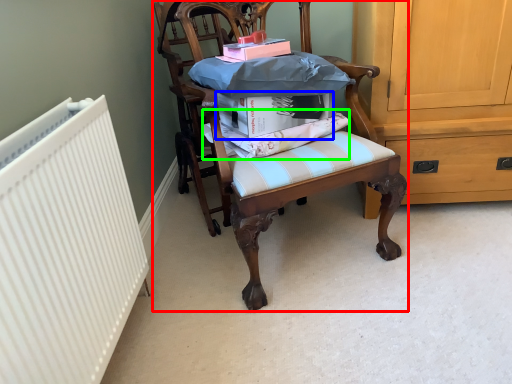
Question: Estimate the real-world distances between objects in this image. Which object is closer to chair (highlighted by a red box), book (highlighted by a blue box) or fabric (highlighted by a green box)?

Choices:
 (A) book
 (B) fabric

Answer: (B)